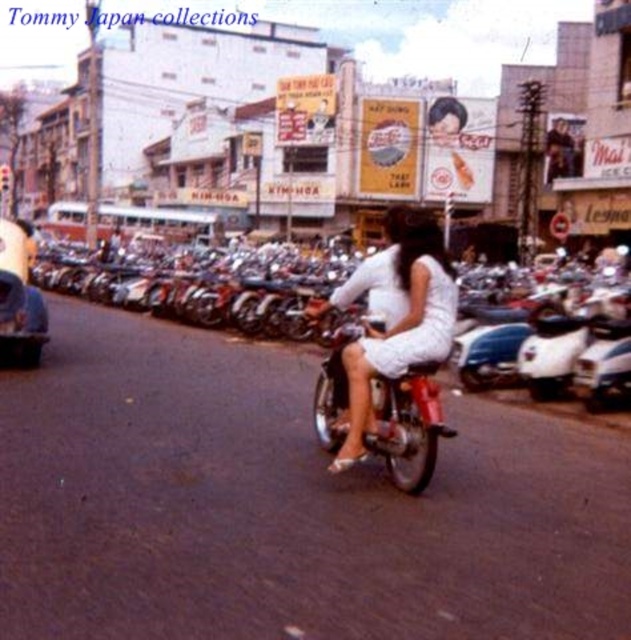
You are a delivery person needing to park your vehicle between the shiny chrome motorcycle at center and the metallic silver car at left. Your vehicle is 2 meters long. Is there enough space between them to park your vehicle?

The distance between the shiny chrome motorcycle at center and the metallic silver car at left is 7.02 meters. Since your vehicle is only 2 meters long, there is sufficient space to park between them.

You are a delivery person who needs to park your vehicle between the shiny chrome motorcycle at center and the metallic silver car at left. Given that your delivery van is 1.8 meters wide, can you fit it in the space between them?

The shiny chrome motorcycle at center is narrower than the metallic silver car at left. However, the exact width of the space between them isn not specified. Without knowing the distance between the two vehicles, it is impossible to determine if the 1.8 meter wide delivery van can fit.